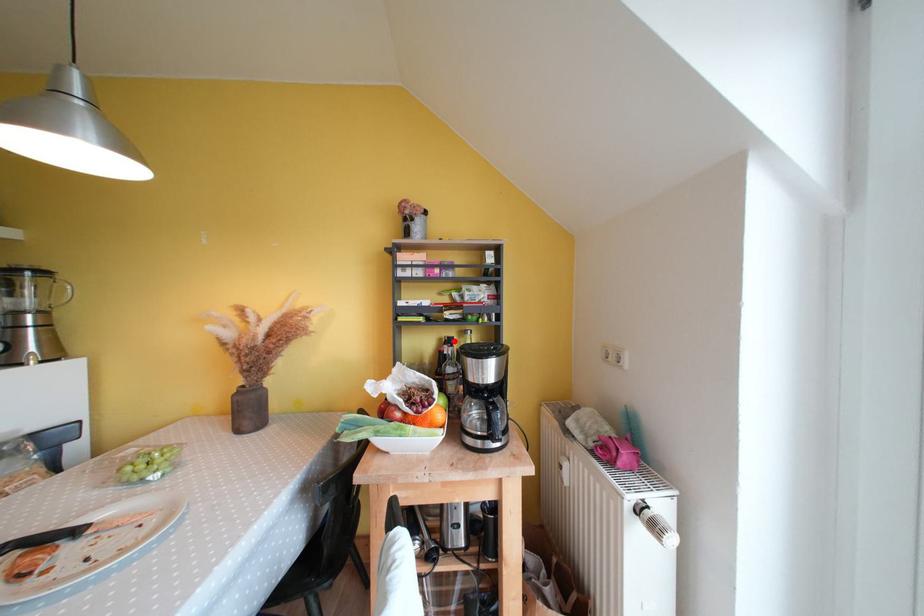
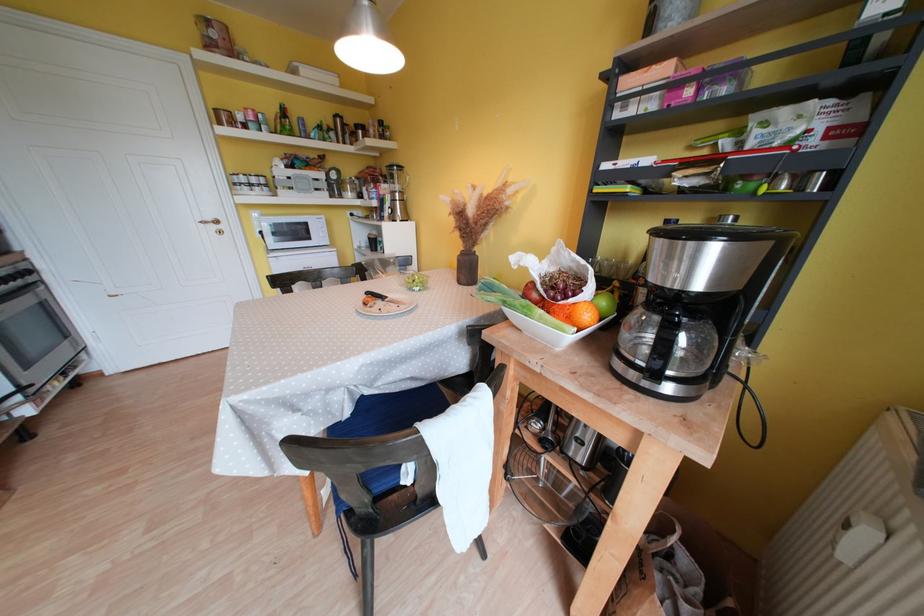
The point at the highlighted location is marked in the first image. Where is the corresponding point in the second image?

(673, 224)